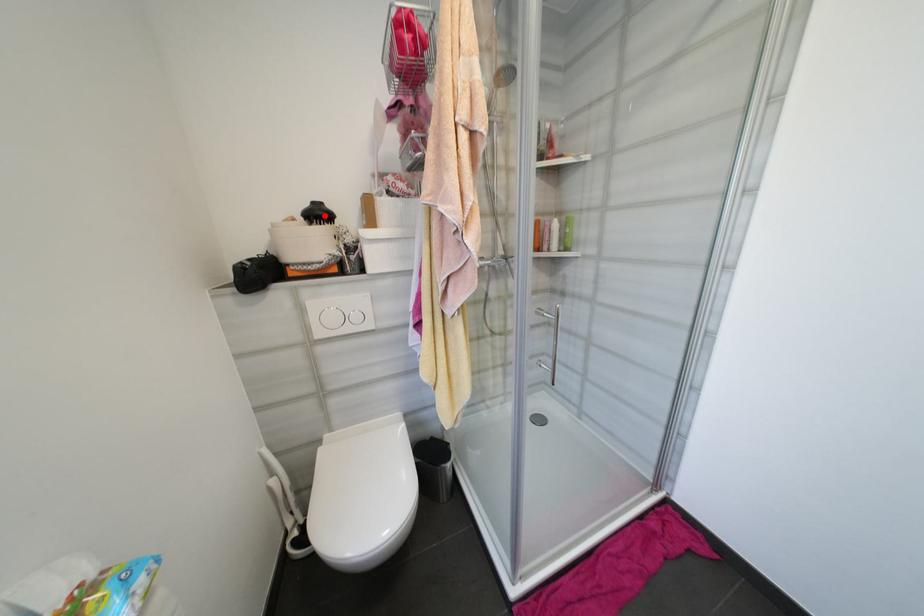
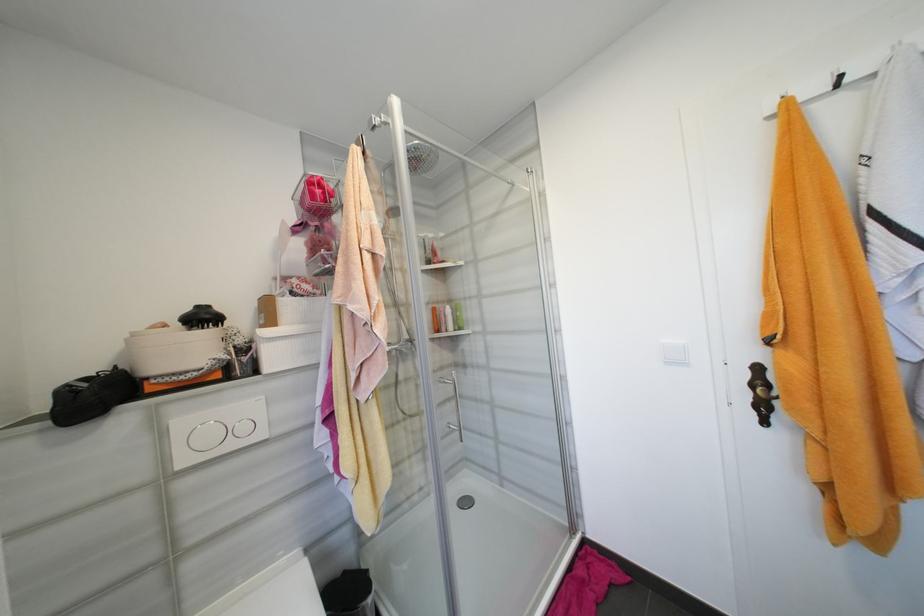
Find the pixel in the second image that matches the highlighted location in the first image.

(210, 318)